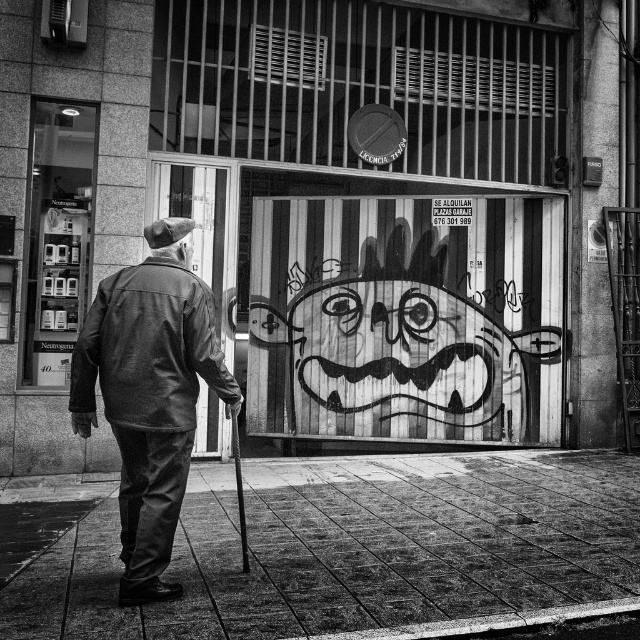
Does smooth concrete pavement at center come in front of leather jacket at center?

No, it is not.

Does smooth concrete pavement at center have a lesser width compared to leather jacket at center?

Yes, smooth concrete pavement at center is thinner than leather jacket at center.

Who is more distant from viewer, [588,536] or [147,374]?

The point [588,536] is more distant.

The image size is (640, 640). In order to click on smooth concrete pavement at center in this screenshot , I will do coord(355,547).